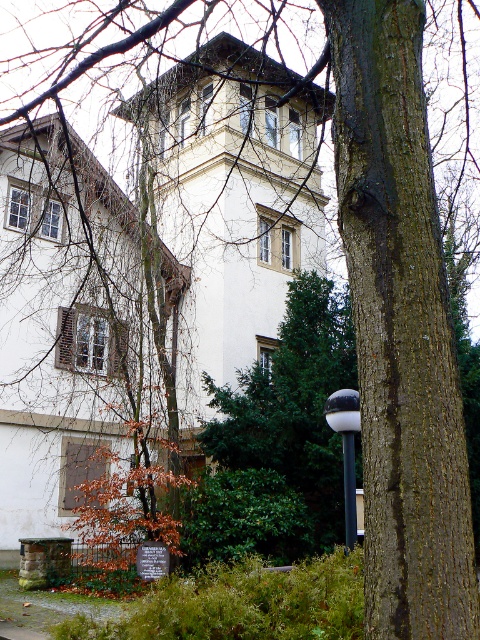
Question: Does white smooth building at center lie in front of black metal pole at center?

Choices:
 (A) yes
 (B) no

Answer: (A)

Question: Which point is closer to the camera?

Choices:
 (A) (352, 461)
 (B) (342, 436)

Answer: (A)

Question: Can you confirm if white glossy lamp post at center right is positioned to the right of black metal pole at center?

Choices:
 (A) yes
 (B) no

Answer: (A)

Question: Considering the real-world distances, which object is closest to the black metal pole at center?

Choices:
 (A) white smooth building at center
 (B) white glossy lamp post at center right

Answer: (B)

Question: Is white smooth building at center thinner than black metal pole at center?

Choices:
 (A) yes
 (B) no

Answer: (B)

Question: Which point appears farthest from the camera in this image?

Choices:
 (A) (80, 404)
 (B) (347, 419)

Answer: (A)